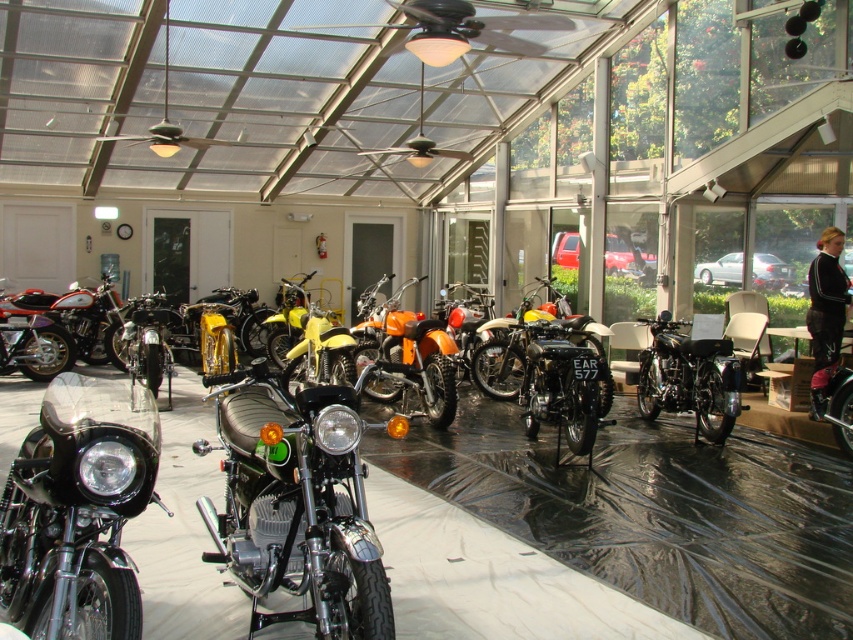
Question: Does shiny black motorcycle at center appear over shiny chrome motorcycle at left?

Choices:
 (A) no
 (B) yes

Answer: (A)

Question: Is black polished motorcycle at left wider than orange matte motorcycle at center?

Choices:
 (A) no
 (B) yes

Answer: (B)

Question: Does orange matte motorcycle at center have a larger size compared to shiny chrome motorcycle at left?

Choices:
 (A) yes
 (B) no

Answer: (B)

Question: Among these objects, which one is nearest to the camera?

Choices:
 (A) shiny chrome motorcycle at left
 (B) shiny black motorcycle at center

Answer: (B)

Question: Which point is closer to the camera?

Choices:
 (A) black polished motorcycle at left
 (B) shiny chrome motorcycle at left
 (C) black shiny motorcycle at center
 (D) shiny black motorcycle at center

Answer: (A)

Question: Based on their relative distances, which object is farther from the black polished motorcycle at left?

Choices:
 (A) black shiny motorcycle at center
 (B) orange matte motorcycle at center
 (C) shiny black motorcycle at center
 (D) shiny chrome motorcycle at left

Answer: (D)